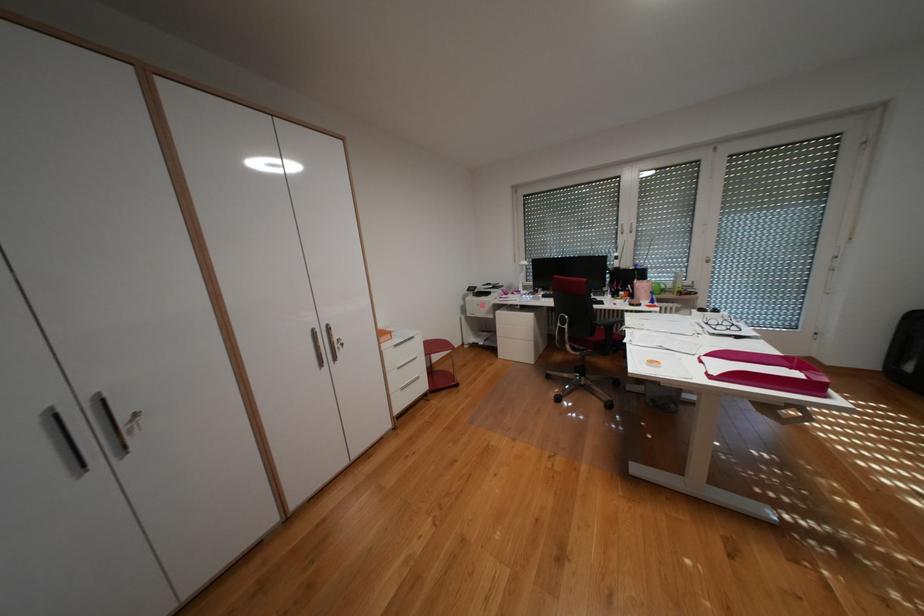
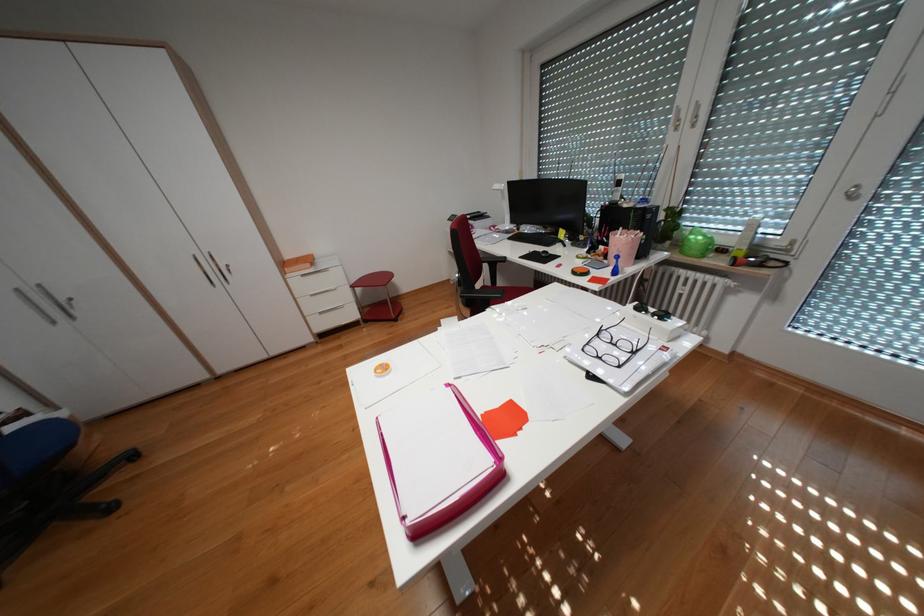
Find the pixel in the second image that matches pixel 643 294 in the first image.

(618, 254)